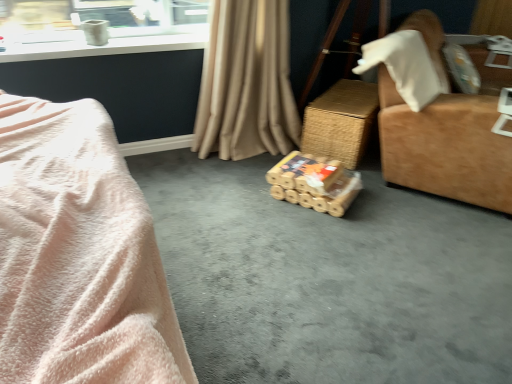
What do you see at coordinates (449, 141) in the screenshot?
I see `suede-like brown armchair at right` at bounding box center [449, 141].

Locate an element on the screen. suede-like brown armchair at right is located at coordinates (449, 141).

Identify the location of soft pink plush at left. (78, 255).

You are a GUI agent. You are given a task and a screenshot of the screen. Output one action in this format:
    pyautogui.click(x=<x>, y=<y>)
    Task: Click on the suede-like brown armchair at right
    
    Given the screenshot: What is the action you would take?
    pyautogui.click(x=449, y=141)

At what (x,y) coordinates should I click in order to perform the action: click on bed on the left of woven brown table at center. Please return your answer as a coordinate pair (x, y). The width and height of the screenshot is (512, 384). Looking at the image, I should click on (78, 255).

From a real-world perspective, between soft pink plush at left and woven brown table at center, who is vertically higher?

soft pink plush at left.

Can woven brown table at center be found inside soft pink plush at left?

No, woven brown table at center is located outside of soft pink plush at left.

Considering the relative positions of soft pink plush at left and beige fabric curtain at center in the image provided, is soft pink plush at left to the right of beige fabric curtain at center from the viewer's perspective?

No, soft pink plush at left is not to the right of beige fabric curtain at center.

Which is in front, soft pink plush at left or beige fabric curtain at center?

Positioned in front is soft pink plush at left.

Is soft pink plush at left situated inside beige fabric curtain at center or outside?

soft pink plush at left is outside beige fabric curtain at center.

Looking at this image, who is more distant, bamboo-textured toy at center or suede-like brown armchair at right?

bamboo-textured toy at center.

Is bamboo-textured toy at center outside of suede-like brown armchair at right?

Indeed, bamboo-textured toy at center is completely outside suede-like brown armchair at right.

Is bamboo-textured toy at center in contact with suede-like brown armchair at right?

bamboo-textured toy at center and suede-like brown armchair at right are not in contact.

Between bamboo-textured toy at center and suede-like brown armchair at right, which one has smaller size?

With smaller size is bamboo-textured toy at center.

Considering the relative sizes of bamboo-textured toy at center and beige fabric curtain at center in the image provided, is bamboo-textured toy at center shorter than beige fabric curtain at center?

Yes.

Consider the image. Can you confirm if bamboo-textured toy at center is wider than beige fabric curtain at center?

Yes.

Is bamboo-textured toy at center far away from beige fabric curtain at center?

No, bamboo-textured toy at center is in close proximity to beige fabric curtain at center.

Is bamboo-textured toy at center at the right side of beige fabric curtain at center?

Yes, bamboo-textured toy at center is to the right of beige fabric curtain at center.

From the image's perspective, is beige fabric curtain at center located above soft pink plush at left?

Yes.

In the scene shown: Measure the distance between beige fabric curtain at center and soft pink plush at left.

beige fabric curtain at center is 1.60 meters from soft pink plush at left.

Identify the location of bed in front of the beige fabric curtain at center. (78, 255).

Is beige fabric curtain at center positioned far away from brown cardboard boxes at center?

That's not correct — beige fabric curtain at center is a little close to brown cardboard boxes at center.

Is beige fabric curtain at center to the left of brown cardboard boxes at center from the viewer's perspective?

Indeed, beige fabric curtain at center is positioned on the left side of brown cardboard boxes at center.

Considering the points (248, 13) and (404, 293), which point is behind, point (248, 13) or point (404, 293)?

The point (248, 13) is farther from the camera.

Considering the sizes of beige fabric curtain at center and brown cardboard boxes at center in the image, is beige fabric curtain at center bigger or smaller than brown cardboard boxes at center?

Clearly, beige fabric curtain at center is larger in size than brown cardboard boxes at center.

Considering the sizes of objects woven brown table at center and bamboo-textured toy at center in the image provided, who is taller, woven brown table at center or bamboo-textured toy at center?

With more height is woven brown table at center.

Does woven brown table at center come behind bamboo-textured toy at center?

Yes, woven brown table at center is further from the camera.

From the image's perspective, is woven brown table at center located above or below bamboo-textured toy at center?

From the image's perspective, woven brown table at center appears above bamboo-textured toy at center.

This screenshot has height=384, width=512. Identify the location of bed that is on the left side of woven brown table at center. (78, 255).

Where is `bed that appears above the beige fabric curtain at center (from a real-world perspective)`? bed that appears above the beige fabric curtain at center (from a real-world perspective) is located at coordinates (78, 255).

Considering their positions, is brown cardboard boxes at center positioned further to bamboo-textured toy at center than beige fabric curtain at center?

Based on the image, beige fabric curtain at center appears to be further to bamboo-textured toy at center.

When comparing their distances from soft pink plush at left, does suede-like brown armchair at right or woven brown table at center seem closer?

suede-like brown armchair at right is closer to soft pink plush at left.

Estimate the real-world distances between objects in this image. Which object is closer to beige fabric curtain at center, brown cardboard boxes at center or woven brown table at center?

Among the two, woven brown table at center is located nearer to beige fabric curtain at center.

Based on their spatial positions, is brown cardboard boxes at center or suede-like brown armchair at right further from beige fabric curtain at center?

Among the two, brown cardboard boxes at center is located further to beige fabric curtain at center.

From the picture: From the image, which object appears to be nearer to suede-like brown armchair at right, beige fabric curtain at center or soft pink plush at left?

beige fabric curtain at center.

Considering their positions, is soft pink plush at left positioned further to suede-like brown armchair at right than bamboo-textured toy at center?

Based on the image, soft pink plush at left appears to be further to suede-like brown armchair at right.

Which object lies further to the anchor point suede-like brown armchair at right, soft pink plush at left or woven brown table at center?

soft pink plush at left.

Estimate the real-world distances between objects in this image. Which object is further from woven brown table at center, bamboo-textured toy at center or brown cardboard boxes at center?

brown cardboard boxes at center.

Where is `concrete positioned between soft pink plush at left and bamboo-textured toy at center from near to far`? The width and height of the screenshot is (512, 384). concrete positioned between soft pink plush at left and bamboo-textured toy at center from near to far is located at coordinates (328, 279).

The image size is (512, 384). I want to click on furniture between brown cardboard boxes at center and woven brown table at center in the front-back direction, so click(449, 141).

Where is `curtain between soft pink plush at left and suede-like brown armchair at right in the horizontal direction`? Image resolution: width=512 pixels, height=384 pixels. curtain between soft pink plush at left and suede-like brown armchair at right in the horizontal direction is located at coordinates (246, 82).

The image size is (512, 384). Find the location of `concrete between beige fabric curtain at center and suede-like brown armchair at right from left to right`. concrete between beige fabric curtain at center and suede-like brown armchair at right from left to right is located at coordinates (328, 279).